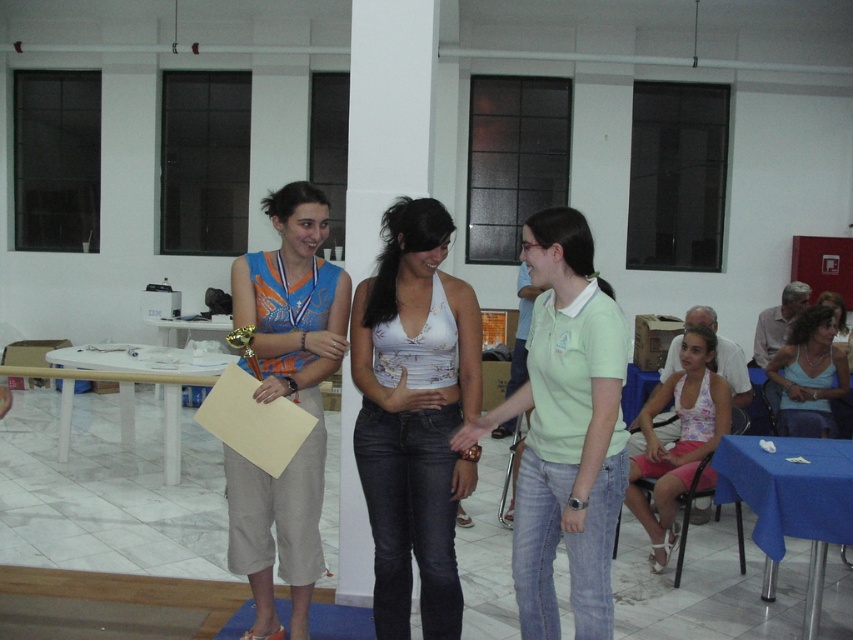
You are standing at the wooden section at the bottom left corner of the room. You see two points marked in the image. Which point is closer to you? The points are point [674,474] and point [786,406].

Point [674,474] is in front of point [786,406], so it is closer to you.